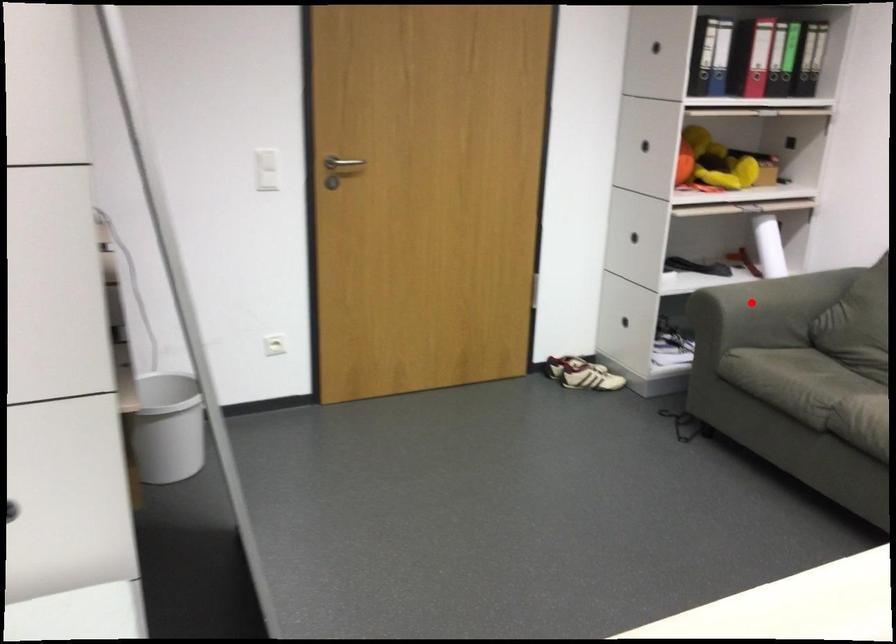
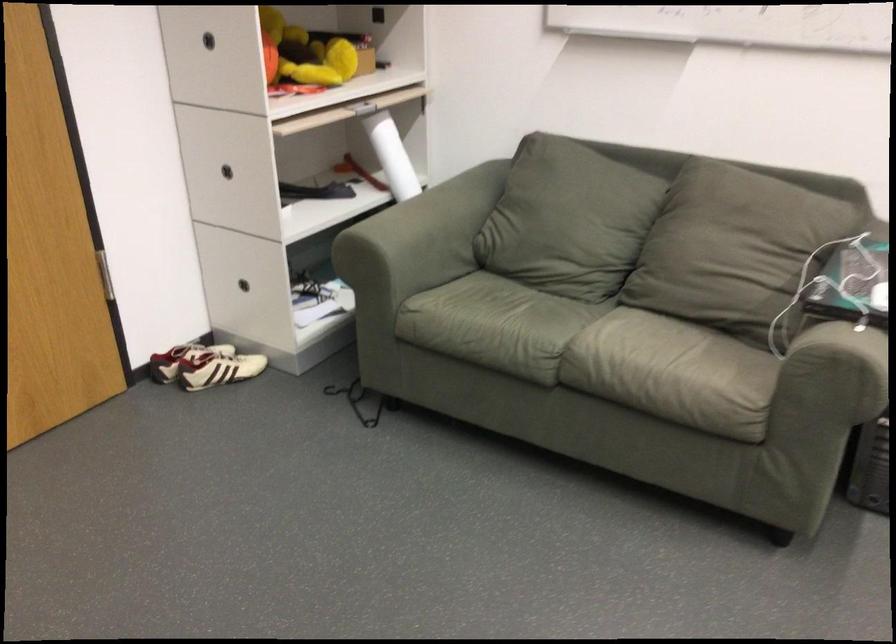
Question: I am providing you with two images of the same scene from different viewpoints. In image1, a red point is highlighted. Considering the same 3D point in image2, which of the following is correct?

Choices:
 (A) It is closer
 (B) It is farther

Answer: (A)